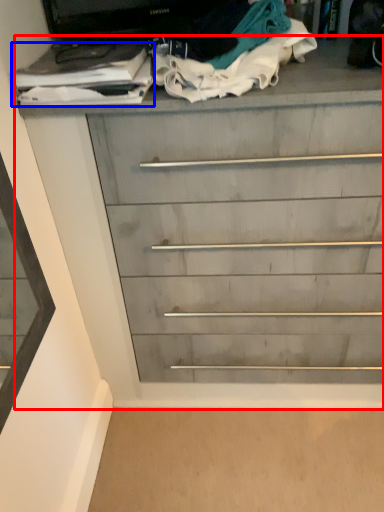
Question: Which object appears farthest to the camera in this image, chest of drawers (highlighted by a red box) or clothing (highlighted by a blue box)?

Choices:
 (A) chest of drawers
 (B) clothing

Answer: (B)